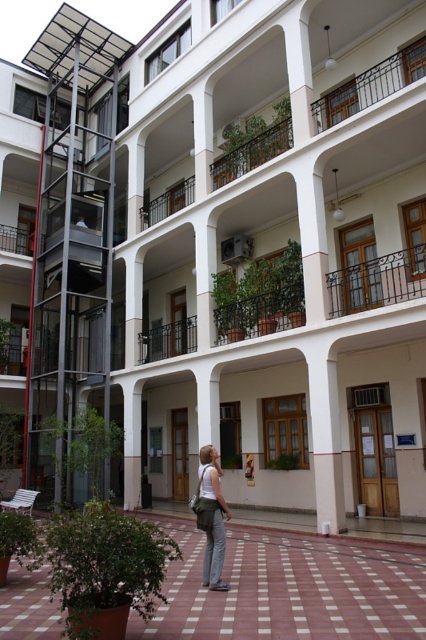
Question: Is terracotta tiles at center closer to camera compared to matte white tank top at center?

Choices:
 (A) no
 (B) yes

Answer: (A)

Question: Is terracotta tiles at center further to camera compared to matte white tank top at center?

Choices:
 (A) yes
 (B) no

Answer: (A)

Question: Which object appears closest to the camera in this image?

Choices:
 (A) terracotta tiles at center
 (B) matte white tank top at center

Answer: (B)

Question: Does terracotta tiles at center have a greater width compared to matte white tank top at center?

Choices:
 (A) no
 (B) yes

Answer: (B)